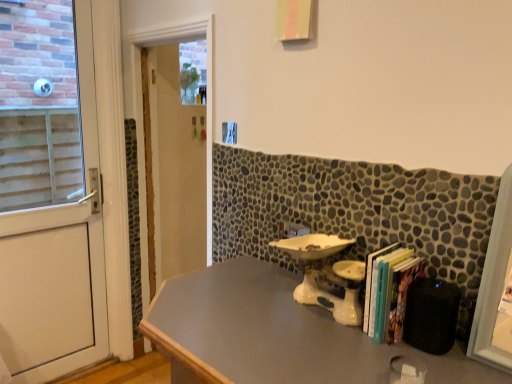
This screenshot has height=384, width=512. In order to click on free space in front of hardcover books at right in this screenshot , I will do `click(404, 362)`.